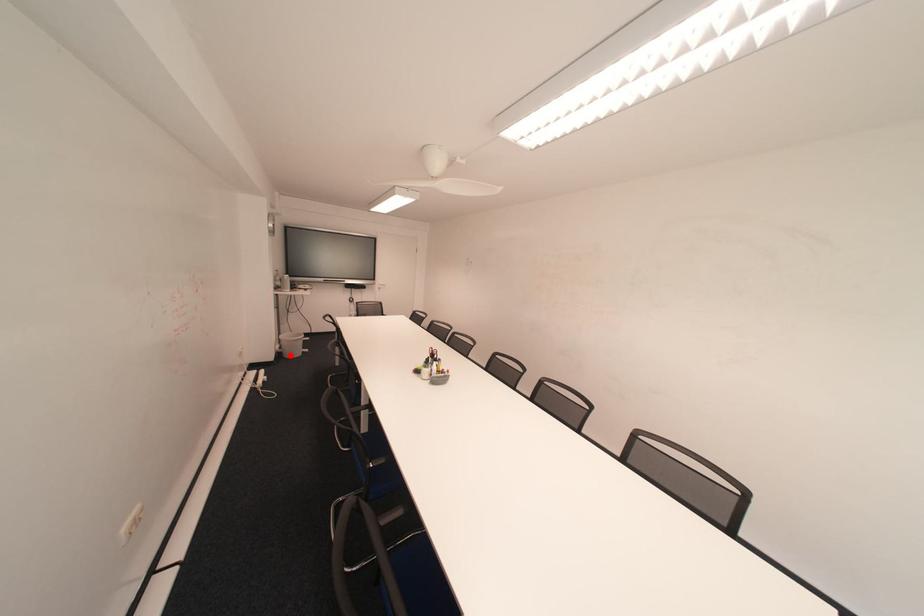
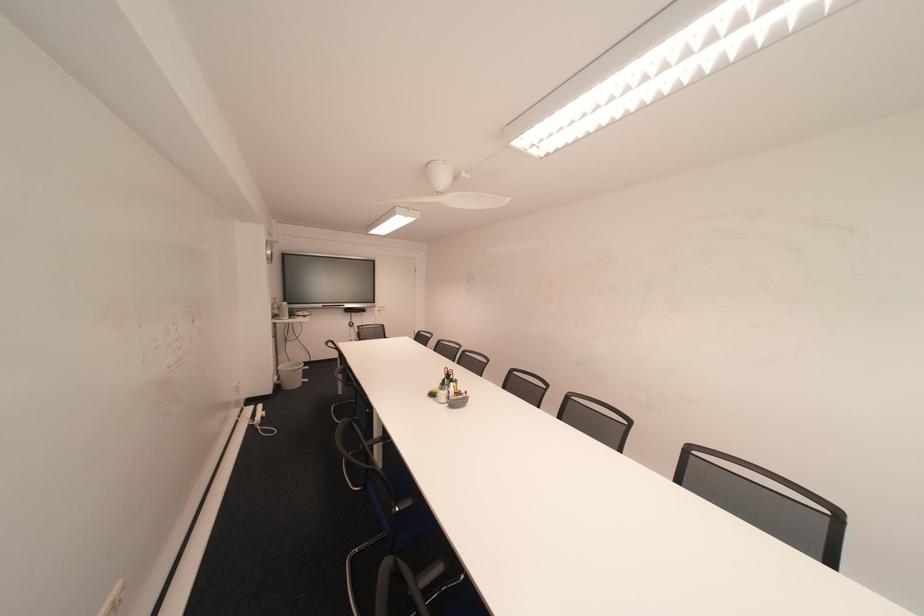
Question: A red point is marked in image1. In image2, is the corresponding 3D point closer to the camera or farther? Reply with the corresponding letter.

Choices:
 (A) The corresponding 3D point is closer.
 (B) The corresponding 3D point is farther.

Answer: (A)